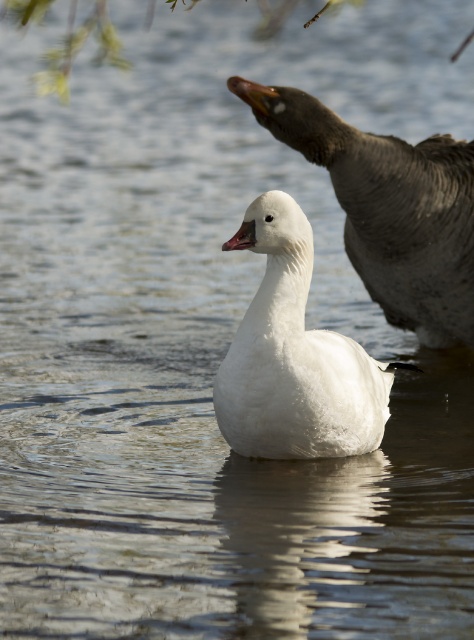
Question: Is dark gray matte goose at upper right in front of matte pink beak at center?

Choices:
 (A) yes
 (B) no

Answer: (B)

Question: Which object is the farthest from the white matte goose at center?

Choices:
 (A) matte pink beak at center
 (B) dark gray matte goose at upper right

Answer: (B)

Question: Can you confirm if white matte goose at center is positioned to the left of matte pink beak at center?

Choices:
 (A) yes
 (B) no

Answer: (B)

Question: Which point is farther to the camera?

Choices:
 (A) dark gray matte goose at upper right
 (B) matte pink beak at center
 (C) white matte goose at center

Answer: (A)

Question: Among these points, which one is farthest from the camera?

Choices:
 (A) (212, 396)
 (B) (245, 221)

Answer: (A)

Question: Does dark gray matte goose at upper right have a lesser width compared to white matte goose at center?

Choices:
 (A) no
 (B) yes

Answer: (A)